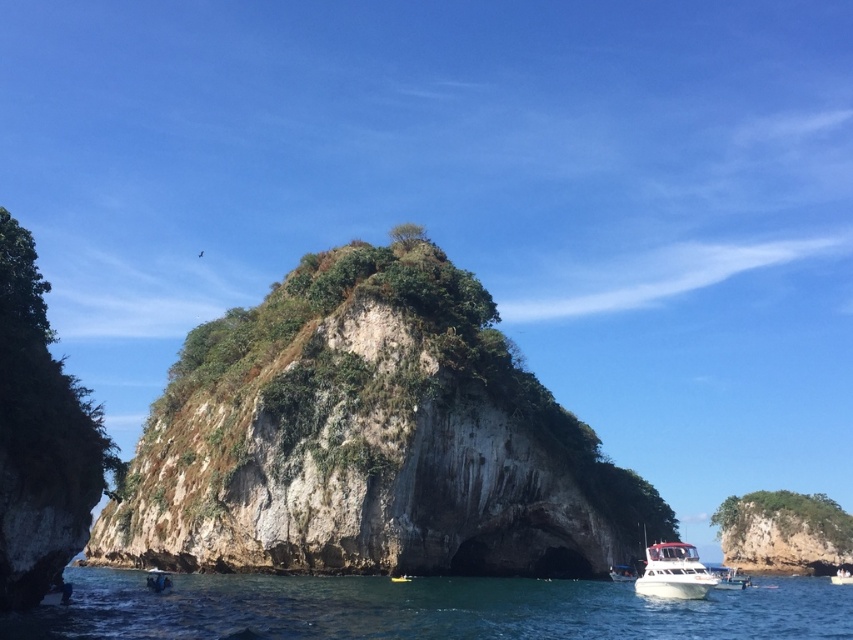
You are a photographer planning to capture the rough stone cliff at center and the white glossy boat at lower center in a single shot. Based on their sizes, which object should you focus on to ensure both are clearly visible in the frame?

The rough stone cliff at center is larger in size than the white glossy boat at lower center, so focusing on the rough stone cliff at center will ensure both objects are clearly visible in the frame.

You are a sailor navigating a small boat near the rocky island. You see a point marked at coordinates (370, 440). What does this point indicate?

The point at coordinates (370, 440) indicates a rough stone cliff at the center of the island.